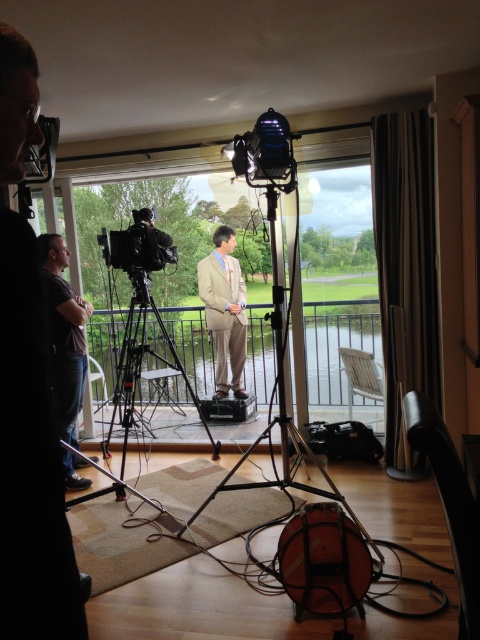
You are setting up a video shoot in the room described. You need to ensure that the tan fabric suit at center and the black metal tripod at center are positioned so that the tripod is not blocking the subject. Given their sizes, which object should be placed closer to the camera to avoid obstruction?

The tan fabric suit at center is smaller than the black metal tripod at center. To avoid obstruction, the larger black metal tripod at center should be placed closer to the camera so that its size does not block the subject.

Looking at this image, you are setting up a video recording in the room. The camera is positioned at the entrance of the glass doors. Which direction should you move the camera to get a better view of the tan fabric suit at center?

The tan fabric suit at center is located at point (x=225, y=310). Since the camera is at the entrance of the glass doors, you should move it towards the center of the room to capture the suit better.

You are a camera operator setting up for a video shoot. You need to ensure that both the matte black shirt at left and the tan fabric suit at center are visible in the frame. Based on their positions, which one is closer to the bottom of the image?

The matte black shirt at left is positioned under the tan fabric suit at center, so it is closer to the bottom of the image.